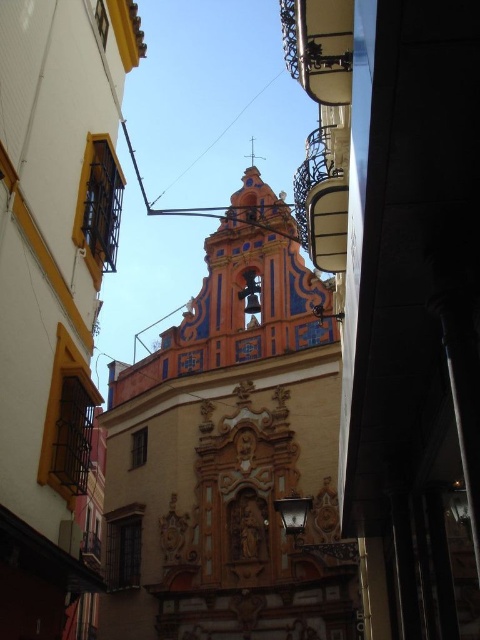
Between orange painted stone church at center and ornate painted facade at center, which one appears on the right side from the viewer's perspective?

orange painted stone church at center

Which is in front, point (321, 323) or point (16, 301)?

Positioned in front is point (16, 301).

I want to click on orange painted stone church at center, so click(230, 452).